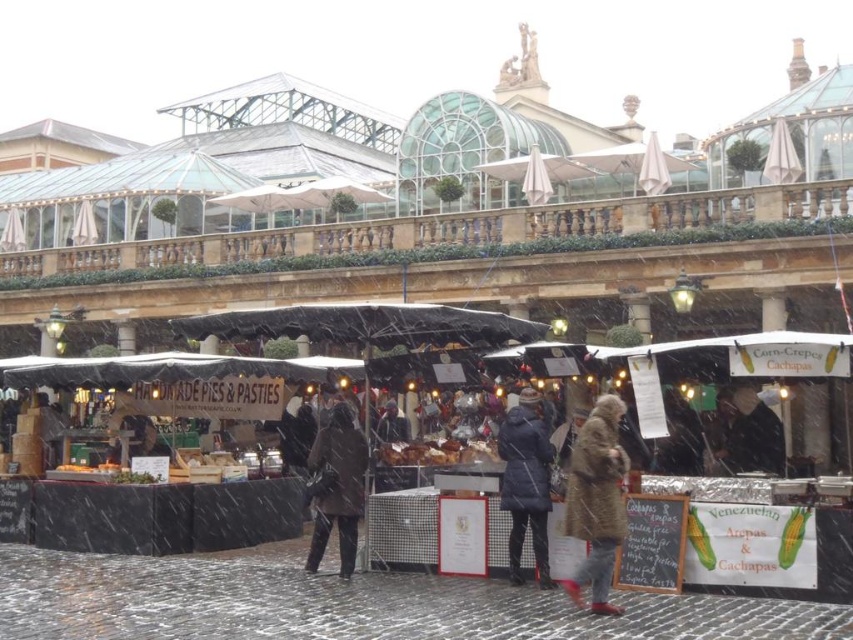
Question: Does dark blue fabric coat at center have a larger size compared to brown wool coat at center?

Choices:
 (A) no
 (B) yes

Answer: (B)

Question: Which object appears closest to the camera in this image?

Choices:
 (A) matte black tent at center
 (B) dark brown leather jacket at center
 (C) dark blue fabric coat at center
 (D) brown fur coat at center

Answer: (D)

Question: Which point is farther to the camera?

Choices:
 (A) dark brown leather jacket at center
 (B) brown wool coat at center
 (C) brown fur coat at center
 (D) matte black tent at center

Answer: (A)

Question: Can you confirm if brown fur coat at center is positioned above dark blue fabric coat at center?

Choices:
 (A) yes
 (B) no

Answer: (B)

Question: Which object appears farthest from the camera in this image?

Choices:
 (A) dark blue fabric coat at center
 (B) matte black tent at center
 (C) brown wool coat at center
 (D) dark brown leather jacket at center

Answer: (D)

Question: Can you confirm if brown fur coat at center is thinner than brown wool coat at center?

Choices:
 (A) yes
 (B) no

Answer: (B)